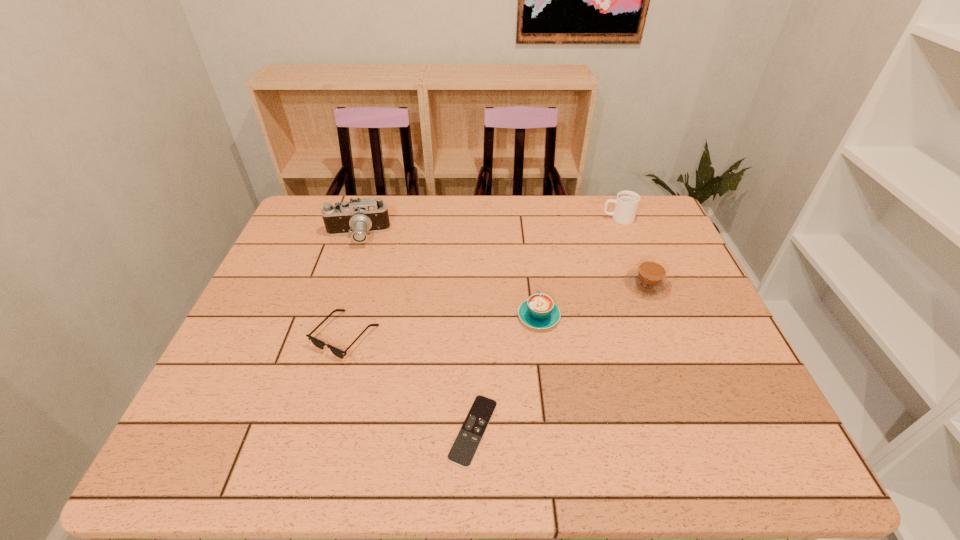
In order to click on free spot that satisfies the following two spatial constraints: 1. on the side with the handle of the fifth shortest object; 2. on the lenses of the second shortest object in this screenshot , I will do `click(663, 336)`.